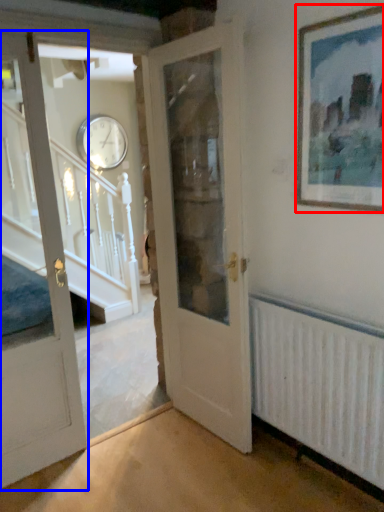
Question: Which point is further to the camera, picture frame (highlighted by a red box) or door (highlighted by a blue box)?

Choices:
 (A) picture frame
 (B) door

Answer: (B)